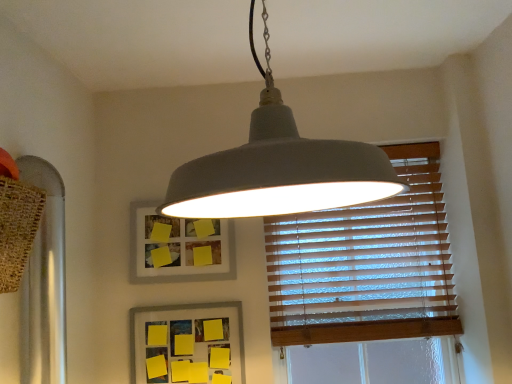
Question: Considering the relative sizes of yellow paper at lower center, which is the first picture frame from bottom to top, and matte gray lampshade at center in the image provided, is yellow paper at lower center, which is the first picture frame from bottom to top, bigger than matte gray lampshade at center?

Choices:
 (A) yes
 (B) no

Answer: (B)

Question: Considering the relative positions of yellow paper at lower center, the 2th picture frame positioned from the top, and matte gray lampshade at center in the image provided, is yellow paper at lower center, the 2th picture frame positioned from the top, to the right of matte gray lampshade at center from the viewer's perspective?

Choices:
 (A) yes
 (B) no

Answer: (B)

Question: Can we say yellow paper at lower center, the 2th picture frame positioned from the top, lies outside matte gray lampshade at center?

Choices:
 (A) yes
 (B) no

Answer: (A)

Question: Can you confirm if yellow paper at lower center, the 2th picture frame positioned from the top, is smaller than matte gray lampshade at center?

Choices:
 (A) yes
 (B) no

Answer: (A)

Question: Does yellow paper at lower center, the 2th picture frame positioned from the top, have a greater width compared to matte gray lampshade at center?

Choices:
 (A) yes
 (B) no

Answer: (B)

Question: Considering the positions of point (168, 342) and point (411, 223), is point (168, 342) closer or farther from the camera than point (411, 223)?

Choices:
 (A) farther
 (B) closer

Answer: (B)

Question: Is yellow paper at lower center, the 2th picture frame positioned from the top, spatially inside wooden blinds at upper right, or outside of it?

Choices:
 (A) inside
 (B) outside

Answer: (B)

Question: Considering the positions of yellow paper at lower center, which is the first picture frame from bottom to top, and wooden blinds at upper right in the image, is yellow paper at lower center, which is the first picture frame from bottom to top, wider or thinner than wooden blinds at upper right?

Choices:
 (A) wide
 (B) thin

Answer: (B)

Question: Is yellow paper at lower center, which is the first picture frame from bottom to top, to the left or to the right of wooden blinds at upper right in the image?

Choices:
 (A) right
 (B) left

Answer: (B)

Question: In terms of height, does matte gray lampshade at center look taller or shorter compared to yellow paper at lower center, the 2th picture frame positioned from the top?

Choices:
 (A) short
 (B) tall

Answer: (B)

Question: From a real-world perspective, is matte gray lampshade at center positioned above or below yellow paper at lower center, the 2th picture frame positioned from the top?

Choices:
 (A) below
 (B) above

Answer: (B)

Question: Is point (373, 188) closer or farther from the camera than point (142, 331)?

Choices:
 (A) farther
 (B) closer

Answer: (B)

Question: Considering their positions, is matte gray lampshade at center located in front of or behind yellow paper at lower center, which is the first picture frame from bottom to top?

Choices:
 (A) front
 (B) behind

Answer: (A)

Question: From the image's perspective, relative to matte gray picture frame at upper center, which is the first picture frame in top-to-bottom order, is matte gray lampshade at center above or below?

Choices:
 (A) below
 (B) above

Answer: (B)

Question: Is matte gray lampshade at center to the left or to the right of matte gray picture frame at upper center, which is the second picture frame in bottom-to-top order, in the image?

Choices:
 (A) left
 (B) right

Answer: (B)